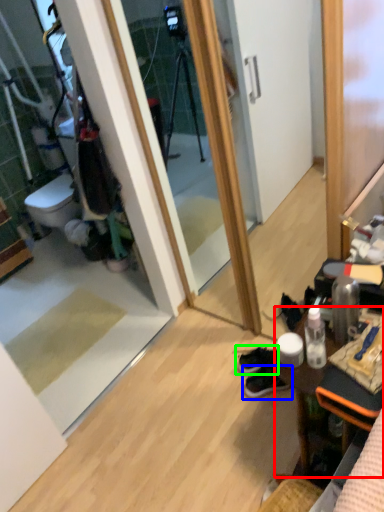
Question: Considering the real-world distances, which object is farthest from desk (highlighted by a red box)? footwear (highlighted by a blue box) or footwear (highlighted by a green box)?

Choices:
 (A) footwear
 (B) footwear

Answer: (B)